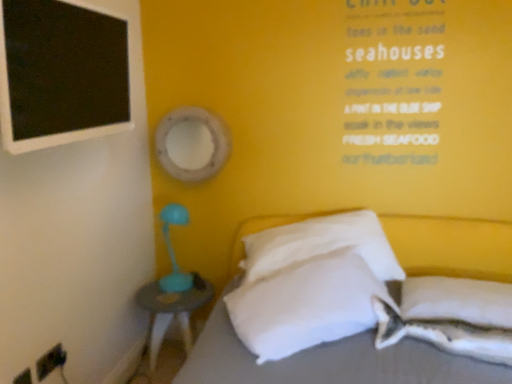
Question: Is white soft pillow at lower right, the second pillow from the right, aimed at white soft pillow at center, which appears as the third pillow when viewed from the right?

Choices:
 (A) yes
 (B) no

Answer: (B)

Question: Does white soft pillow at lower right, the second pillow from the right, have a smaller size compared to white soft pillow at center, the 2th pillow in the left-to-right sequence?

Choices:
 (A) yes
 (B) no

Answer: (A)

Question: From a real-world perspective, does white soft pillow at lower right, which is the third pillow from left to right, sit lower than white soft pillow at center, the 2th pillow in the left-to-right sequence?

Choices:
 (A) yes
 (B) no

Answer: (A)

Question: Considering the relative positions of white soft pillow at lower right, which is the third pillow from left to right, and white soft pillow at center, which appears as the third pillow when viewed from the right, in the image provided, is white soft pillow at lower right, which is the third pillow from left to right, to the right of white soft pillow at center, which appears as the third pillow when viewed from the right, from the viewer's perspective?

Choices:
 (A) yes
 (B) no

Answer: (A)

Question: Is white soft pillow at lower right, which is the third pillow from left to right, closer to camera compared to white soft pillow at center, which appears as the third pillow when viewed from the right?

Choices:
 (A) no
 (B) yes

Answer: (B)

Question: From a real-world perspective, is white soft pillow at lower right, the second pillow from the right, located higher than white soft pillow at center, the 2th pillow in the left-to-right sequence?

Choices:
 (A) yes
 (B) no

Answer: (B)

Question: Considering the relative sizes of white soft pillow at lower right, the 4th pillow from the left, and black matte board at upper left in the image provided, is white soft pillow at lower right, the 4th pillow from the left, taller than black matte board at upper left?

Choices:
 (A) yes
 (B) no

Answer: (B)

Question: Would you say white soft pillow at lower right, the 4th pillow from the left, is outside black matte board at upper left?

Choices:
 (A) yes
 (B) no

Answer: (A)

Question: Is white soft pillow at lower right, the 1th pillow positioned from the right, aimed at black matte board at upper left?

Choices:
 (A) yes
 (B) no

Answer: (B)

Question: Can you confirm if white soft pillow at lower right, the 4th pillow from the left, is shorter than black matte board at upper left?

Choices:
 (A) yes
 (B) no

Answer: (A)

Question: Is white soft pillow at lower right, the 1th pillow positioned from the right, positioned before black matte board at upper left?

Choices:
 (A) yes
 (B) no

Answer: (B)

Question: Is white soft pillow at lower right, the 1th pillow positioned from the right, further to camera compared to black matte board at upper left?

Choices:
 (A) no
 (B) yes

Answer: (B)

Question: Considering the relative positions of black matte board at upper left and white soft pillow at lower right, the 1th pillow positioned from the right, in the image provided, is black matte board at upper left to the right of white soft pillow at lower right, the 1th pillow positioned from the right, from the viewer's perspective?

Choices:
 (A) no
 (B) yes

Answer: (A)